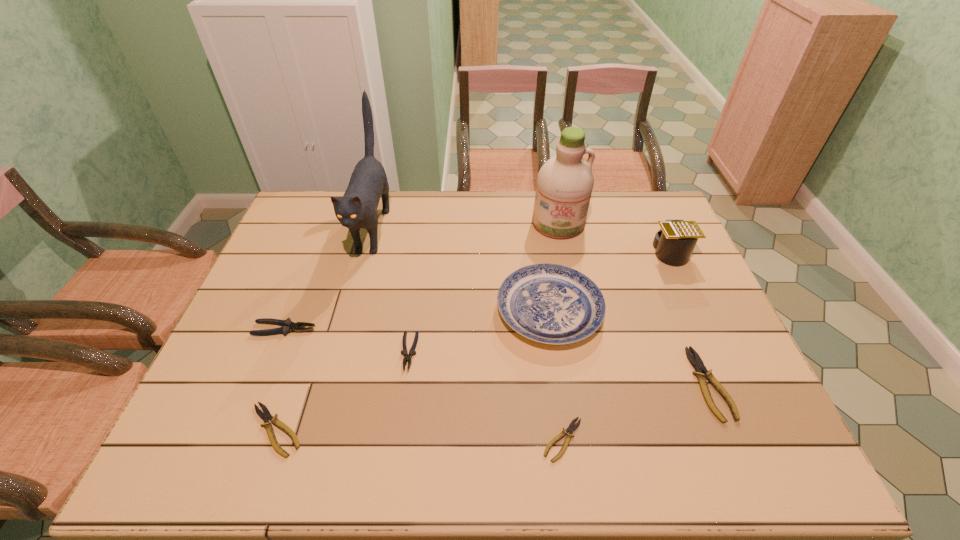
Find the location of a particular element. Image resolution: width=960 pixels, height=540 pixels. vacant point that satisfies the following two spatial constraints: 1. on the front label of the rightmost pliers; 2. on the right side of the cleansing agent is located at coordinates (590, 384).

At what (x,y) coordinates should I click in order to perform the action: click on vacant region that satisfies the following two spatial constraints: 1. at the face of the gray cat; 2. at the gripping part of the left gray pliers. Please return your answer as a coordinate pair (x, y). The height and width of the screenshot is (540, 960). Looking at the image, I should click on (346, 329).

Locate an element on the screen. vacant space that satisfies the following two spatial constraints: 1. at the face of the gray cat; 2. on the left side of the blue plate is located at coordinates (350, 310).

In order to click on free space that satisfies the following two spatial constraints: 1. at the face of the gray cat; 2. on the left side of the smallest yellow pliers in this screenshot , I will do `click(315, 440)`.

This screenshot has width=960, height=540. I want to click on vacant region that satisfies the following two spatial constraints: 1. on the front side of the sixth shortest object; 2. on the left side of the biggest yellow pliers, so click(560, 384).

Locate an element on the screen. free space that satisfies the following two spatial constraints: 1. at the face of the plate; 2. on the right side of the cat is located at coordinates click(x=350, y=310).